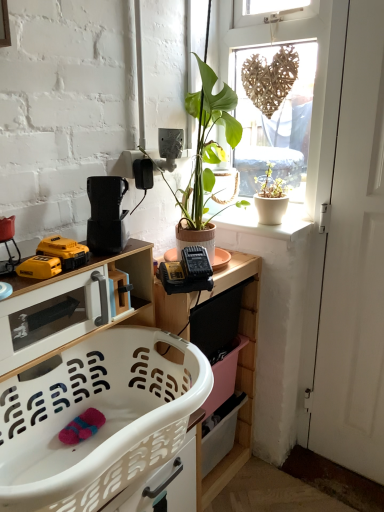
Question: Is yellow plastic drill at lower left, placed as the 1th toy when sorted from back to front, looking in the opposite direction of white plastic laundry basket at lower left, arranged as the second cabinetry when viewed from the top?

Choices:
 (A) no
 (B) yes

Answer: (A)

Question: Does yellow plastic drill at lower left, placed as the 1th toy when sorted from back to front, come behind white plastic laundry basket at lower left, arranged as the second cabinetry when viewed from the top?

Choices:
 (A) no
 (B) yes

Answer: (B)

Question: Can you confirm if yellow plastic drill at lower left, placed as the 2th toy when sorted from front to back, is taller than white plastic laundry basket at lower left, arranged as the second cabinetry when viewed from the top?

Choices:
 (A) yes
 (B) no

Answer: (B)

Question: Is the position of yellow plastic drill at lower left, placed as the 2th toy when sorted from front to back, less distant than that of white plastic laundry basket at lower left, arranged as the second cabinetry when viewed from the top?

Choices:
 (A) no
 (B) yes

Answer: (A)

Question: From the image's perspective, does yellow plastic drill at lower left, placed as the 2th toy when sorted from front to back, appear higher than white plastic laundry basket at lower left, arranged as the second cabinetry when viewed from the top?

Choices:
 (A) no
 (B) yes

Answer: (B)

Question: In the image, is wooden shelf at center on the left side or the right side of white glossy cabinet at lower left, placed as the first cabinetry when sorted from top to bottom?

Choices:
 (A) left
 (B) right

Answer: (B)

Question: Is wooden shelf at center situated inside white glossy cabinet at lower left, placed as the first cabinetry when sorted from top to bottom, or outside?

Choices:
 (A) inside
 (B) outside

Answer: (B)

Question: Does point (248, 333) appear closer or farther from the camera than point (92, 310)?

Choices:
 (A) farther
 (B) closer

Answer: (A)

Question: From the image's perspective, is wooden shelf at center located above or below white glossy cabinet at lower left, the 2th cabinetry in the bottom-to-top sequence?

Choices:
 (A) below
 (B) above

Answer: (A)

Question: From their relative heights in the image, would you say black plastic coffee maker at upper left is taller or shorter than white plastic laundry basket at lower left, arranged as the second cabinetry when viewed from the top?

Choices:
 (A) short
 (B) tall

Answer: (A)

Question: Looking at the image, does black plastic coffee maker at upper left seem bigger or smaller compared to white plastic laundry basket at lower left, which ranks as the first cabinetry in bottom-to-top order?

Choices:
 (A) small
 (B) big

Answer: (A)

Question: From the image's perspective, relative to white plastic laundry basket at lower left, which ranks as the first cabinetry in bottom-to-top order, is black plastic coffee maker at upper left above or below?

Choices:
 (A) below
 (B) above

Answer: (B)

Question: Based on their positions, is black plastic coffee maker at upper left located to the left or right of white plastic laundry basket at lower left, which ranks as the first cabinetry in bottom-to-top order?

Choices:
 (A) right
 (B) left

Answer: (A)

Question: From the image's perspective, is white matte door at right above or below white plastic laundry basket at lower left, which ranks as the first cabinetry in bottom-to-top order?

Choices:
 (A) below
 (B) above

Answer: (B)

Question: Considering their positions, is white matte door at right located in front of or behind white plastic laundry basket at lower left, arranged as the second cabinetry when viewed from the top?

Choices:
 (A) behind
 (B) front

Answer: (A)